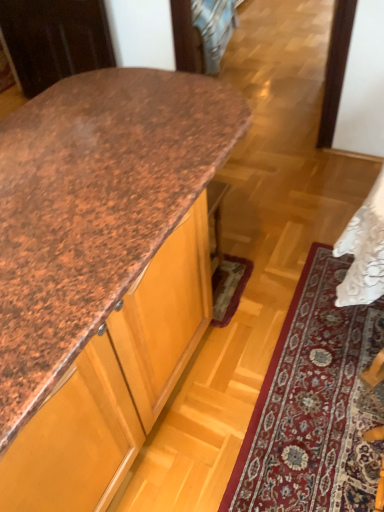
Image resolution: width=384 pixels, height=512 pixels. I want to click on blank space situated above brown speckled laminate countertop at upper left (from a real-world perspective), so click(x=93, y=160).